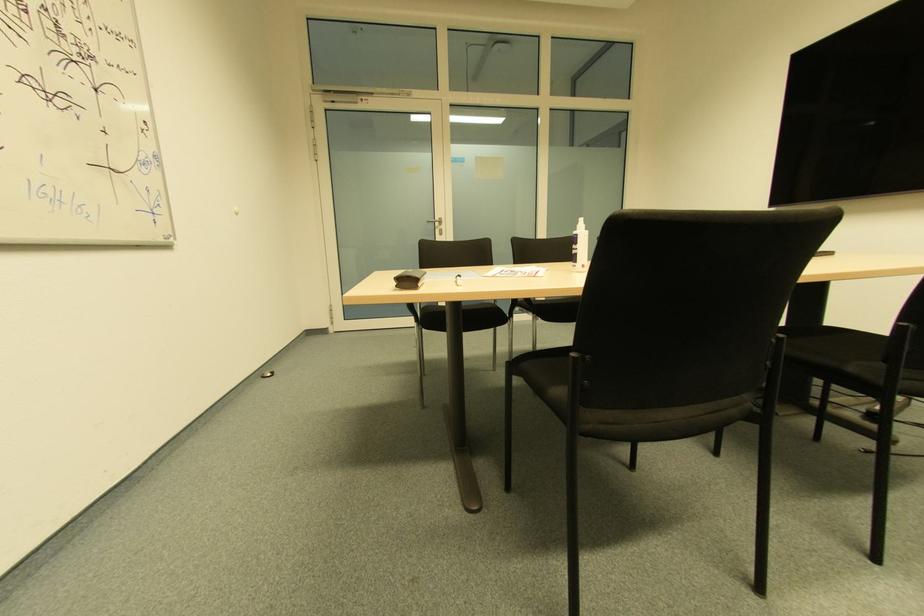
What do you see at coordinates (833, 346) in the screenshot?
I see `the black chair sitting surface` at bounding box center [833, 346].